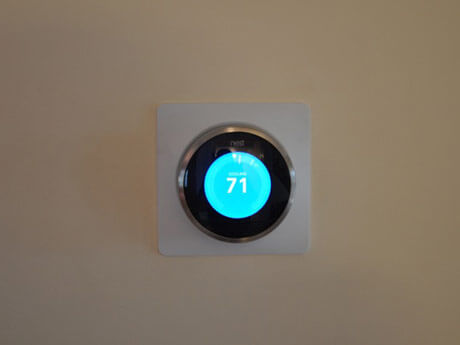
The height and width of the screenshot is (345, 460). What are the coordinates of `empty space on wall to the left of thermostat` in the screenshot? It's located at (115, 169).